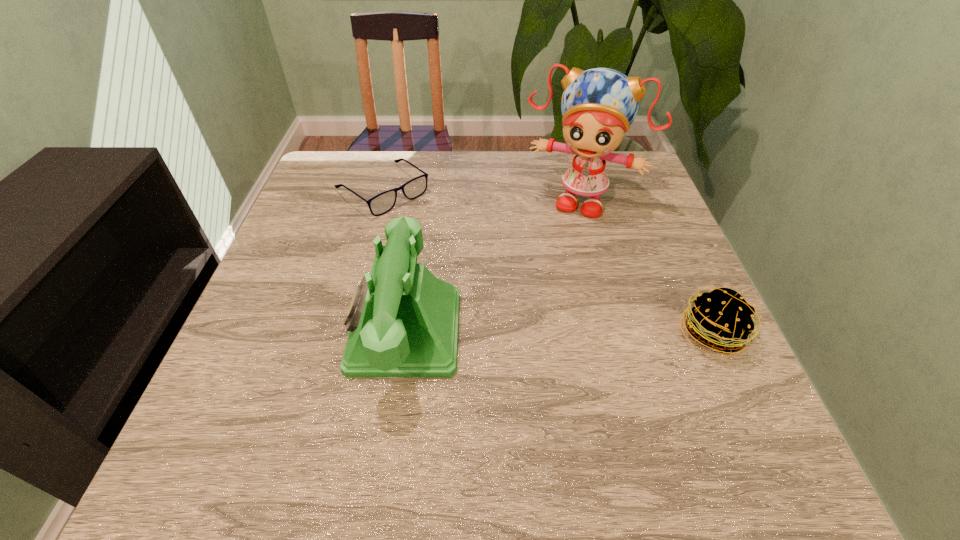
Find the location of a particular element. telephone is located at coordinates (403, 321).

What are the coordinates of `patty` in the screenshot? It's located at (721, 319).

I want to click on doll, so click(599, 105).

Find the location of a particular element. The width and height of the screenshot is (960, 540). the shortest object is located at coordinates (382, 203).

You are a GUI agent. You are given a task and a screenshot of the screen. Output one action in this format:
    pyautogui.click(x=<x>, y=<y>)
    Task: Click on the vacant area located 0.140m on the dial of the third shortest object
    
    Given the screenshot: What is the action you would take?
    pyautogui.click(x=277, y=331)

You are a GUI agent. You are given a task and a screenshot of the screen. Output one action in this format:
    pyautogui.click(x=<x>, y=<y>)
    Task: Click on the vacant space located on the dial of the third shortest object
    Image resolution: width=960 pixels, height=540 pixels.
    Given the screenshot: What is the action you would take?
    pyautogui.click(x=319, y=331)

What are the coordinates of `vacant point located on the back of the patty` in the screenshot? It's located at (689, 284).

This screenshot has width=960, height=540. I want to click on vacant space located 0.180m on the face of the tallest object, so click(x=543, y=267).

Locate an element on the screen. The width and height of the screenshot is (960, 540). vacant position located on the face of the tallest object is located at coordinates (532, 295).

This screenshot has height=540, width=960. I want to click on free spot located on the face of the tallest object, so [x=523, y=316].